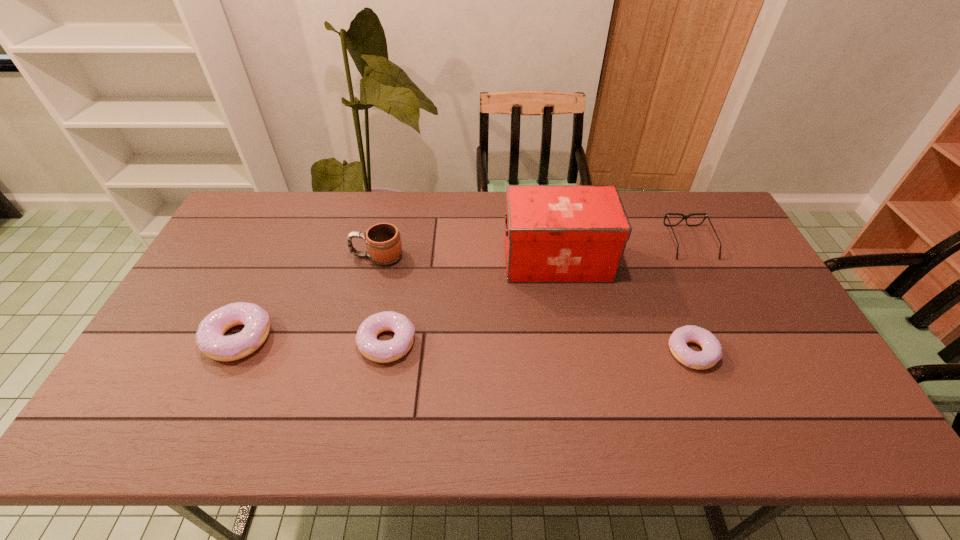
The height and width of the screenshot is (540, 960). What are the coordinates of `vacant space located on the back of the shortest doughnut` in the screenshot? It's located at (665, 284).

Find the location of a particular element. This screenshot has height=540, width=960. free region located 0.060m with the lenses facing outward on the spectacles is located at coordinates (705, 274).

At what (x,y) coordinates should I click in order to perform the action: click on vacant space positioned 0.070m on the handle side of the first-aid kit. Please return your answer as a coordinate pair (x, y). Image resolution: width=960 pixels, height=540 pixels. Looking at the image, I should click on (481, 260).

Locate an element on the screen. This screenshot has height=540, width=960. vacant space located 0.400m on the handle side of the first-aid kit is located at coordinates (376, 260).

Identify the location of vacant region located 0.230m on the handle side of the first-aid kit. The image size is (960, 540). (430, 260).

Where is `free space located 0.070m on the side of the mug with the handle`? free space located 0.070m on the side of the mug with the handle is located at coordinates (328, 256).

Where is `blank space located on the side of the mug with the handle`? blank space located on the side of the mug with the handle is located at coordinates (225, 256).

The height and width of the screenshot is (540, 960). I want to click on free space located on the side of the mug with the handle, so click(x=297, y=256).

Identify the location of object present at the far edge. The height and width of the screenshot is (540, 960). (706, 215).

Identify the location of object that is at the near edge. The height and width of the screenshot is (540, 960). (711, 353).